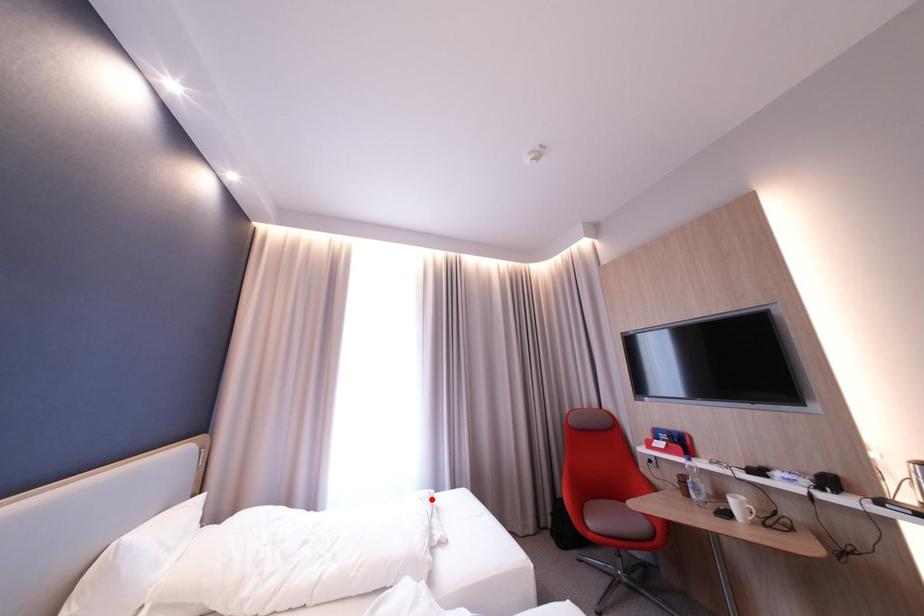
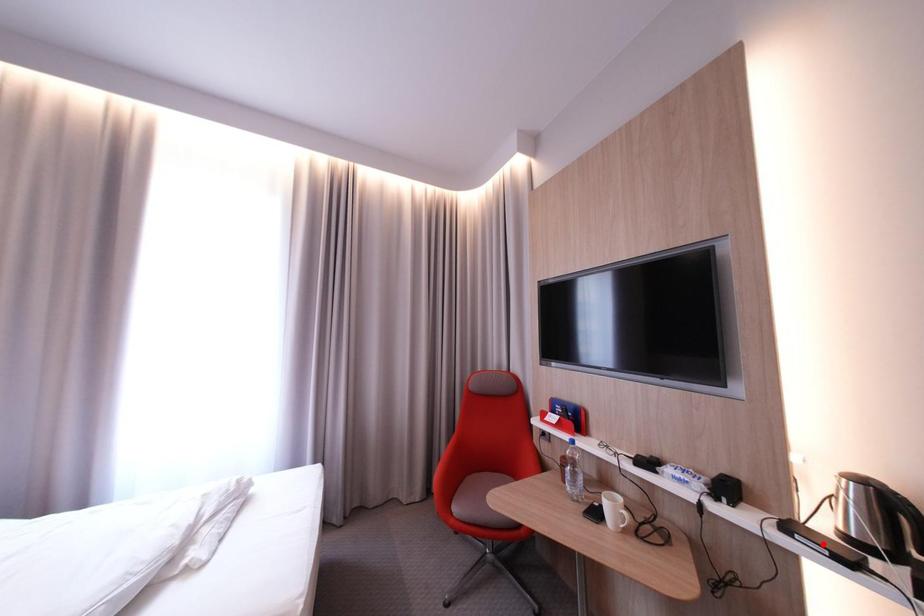
I am providing you with two images of the same scene from different viewpoints. A red point is marked on the first image and another point is marked on the second image. Is the red point in image1 aligned with the point shown in image2?

No